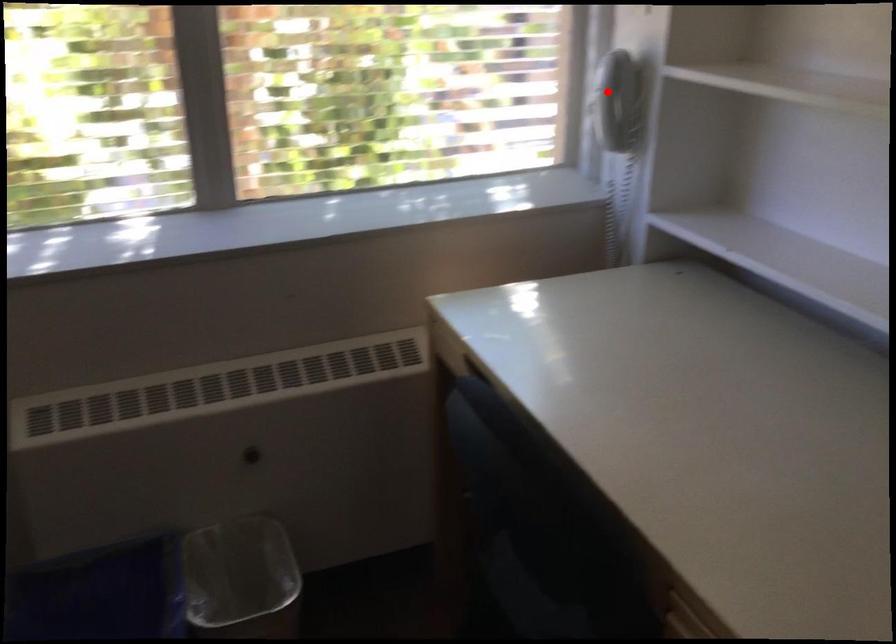
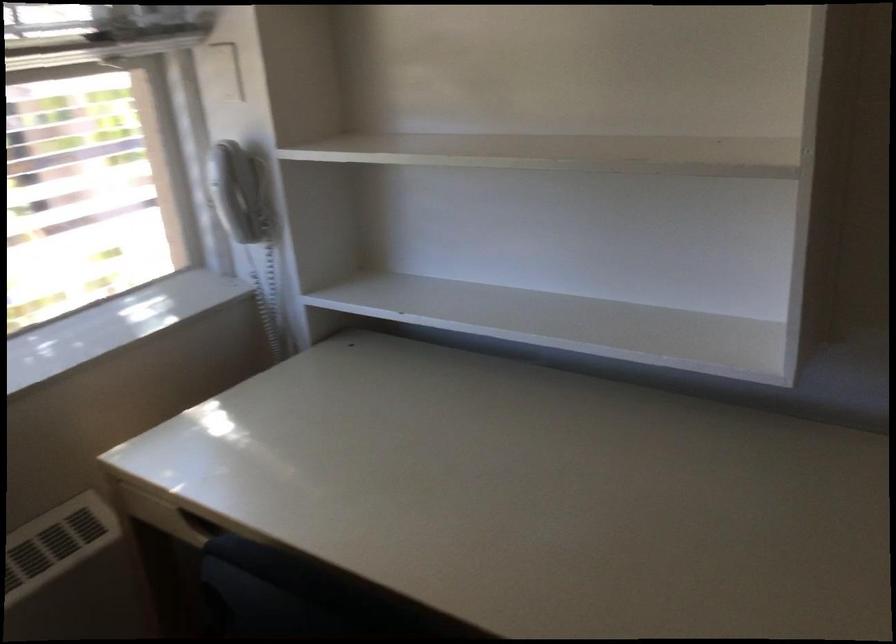
The point at the highlighted location is marked in the first image. Where is the corresponding point in the second image?

(230, 190)